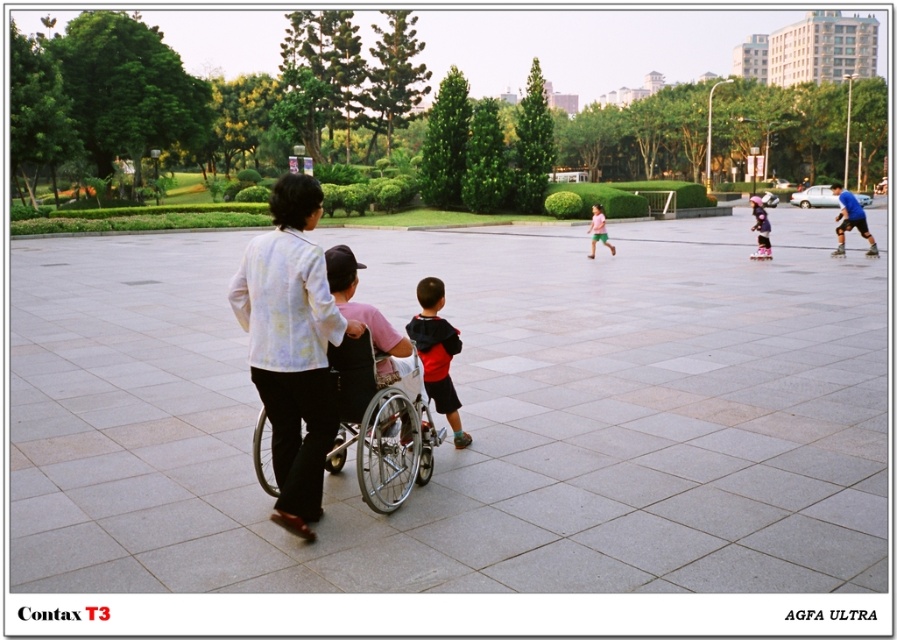
Does purple matte roller skates at center have a lesser width compared to black plastic roller skate at right?

In fact, purple matte roller skates at center might be wider than black plastic roller skate at right.

At what (x,y) coordinates should I click in order to perform the action: click on purple matte roller skates at center. Please return your answer as a coordinate pair (x, y). The width and height of the screenshot is (897, 640). Looking at the image, I should click on (760, 228).

The width and height of the screenshot is (897, 640). I want to click on purple matte roller skates at center, so click(760, 228).

Who is lower down, silver metallic wheelchair at center or red hoodie at center?

silver metallic wheelchair at center is below.

This screenshot has width=897, height=640. Describe the element at coordinates (379, 422) in the screenshot. I see `silver metallic wheelchair at center` at that location.

You are a GUI agent. You are given a task and a screenshot of the screen. Output one action in this format:
    pyautogui.click(x=<x>, y=<y>)
    Task: Click on the silver metallic wheelchair at center
    This screenshot has height=640, width=897.
    Given the screenshot: What is the action you would take?
    tap(379, 422)

Between blue smooth shirt at right and purple matte roller skates at center, which one appears on the right side from the viewer's perspective?

Positioned to the right is blue smooth shirt at right.

Is blue smooth shirt at right to the right of purple matte roller skates at center from the viewer's perspective?

Indeed, blue smooth shirt at right is positioned on the right side of purple matte roller skates at center.

Which is behind, point (849, 212) or point (762, 244)?

The point (762, 244) is more distant.

The width and height of the screenshot is (897, 640). I want to click on blue smooth shirt at right, so click(850, 220).